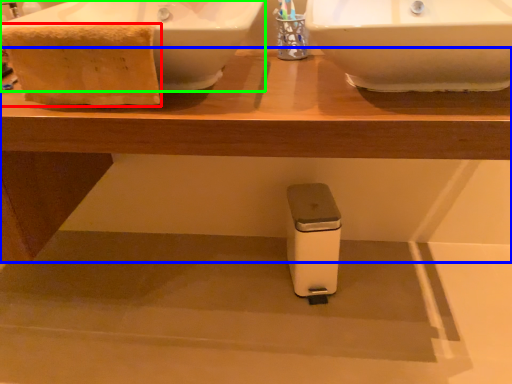
Question: Estimate the real-world distances between objects in this image. Which object is farther from material (highlighted by a red box), table (highlighted by a blue box) or sink (highlighted by a green box)?

Choices:
 (A) table
 (B) sink

Answer: (A)